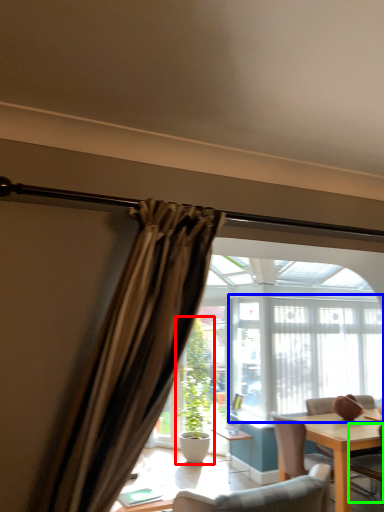
Question: Which object is the closest to the houseplant (highlighted by a red box)? Choose among these: window frame (highlighted by a blue box) or chair (highlighted by a green box).

Choices:
 (A) window frame
 (B) chair

Answer: (A)